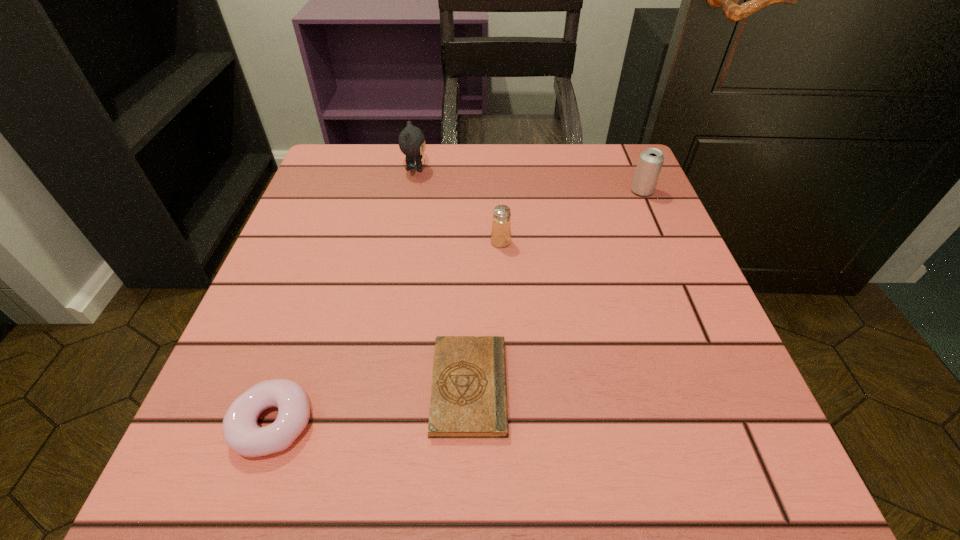
Find the location of `vacant space that's between the kitten and the second farthest object`. vacant space that's between the kitten and the second farthest object is located at coordinates (529, 180).

Locate an element on the screen. The width and height of the screenshot is (960, 540). free spot between the second farthest object and the leftmost object is located at coordinates (458, 307).

Where is `free space between the shortest object and the saltshaker`? free space between the shortest object and the saltshaker is located at coordinates (485, 314).

Locate an element on the screen. This screenshot has width=960, height=540. empty space that is in between the shortest object and the farthest object is located at coordinates (443, 278).

At what (x,y) coordinates should I click in order to perform the action: click on free space that is in between the third farthest object and the shortest object. Please return your answer as a coordinate pair (x, y). This screenshot has width=960, height=540. Looking at the image, I should click on (485, 314).

The height and width of the screenshot is (540, 960). What are the coordinates of `free space that is in between the beer can and the saltshaker` in the screenshot? It's located at (571, 217).

This screenshot has width=960, height=540. Identify the location of blank region between the leftmost object and the shortest object. (372, 405).

The width and height of the screenshot is (960, 540). What are the coordinates of `free point between the rightmost object and the leftmost object` in the screenshot? It's located at pyautogui.click(x=458, y=307).

The width and height of the screenshot is (960, 540). Identify the location of free area in between the fourth tallest object and the farthest object. (345, 296).

This screenshot has width=960, height=540. I want to click on unoccupied area between the shortest object and the third nearest object, so click(x=485, y=314).